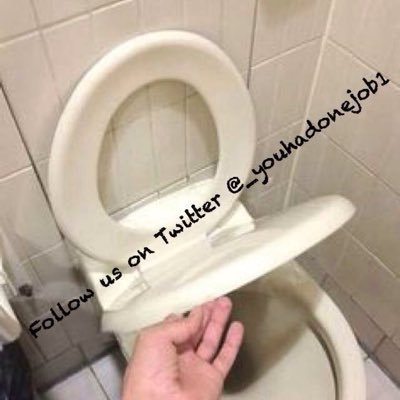
Locate an element on the screen. toilet seat is located at coordinates (125, 81).